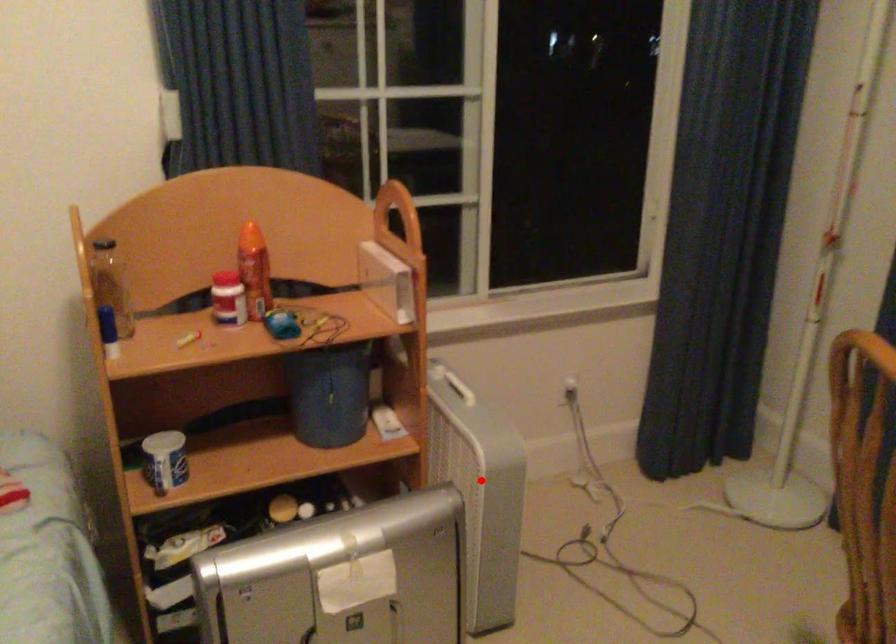
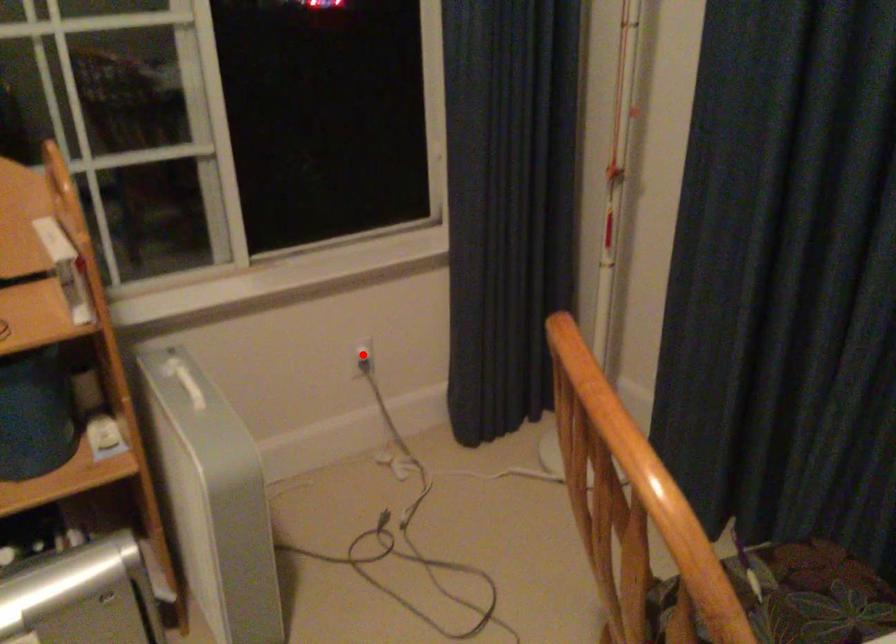
I am providing you with two images of the same scene from different viewpoints. A red point is marked on the first image and another point is marked on the second image. Is the red point in image1 aligned with the point shown in image2?

No